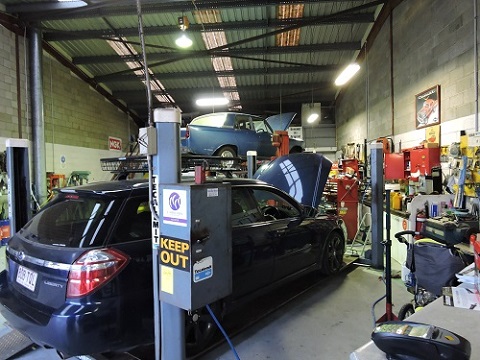
I want to click on ceiling light, so click(182, 41), click(211, 99), click(313, 117), click(340, 81).